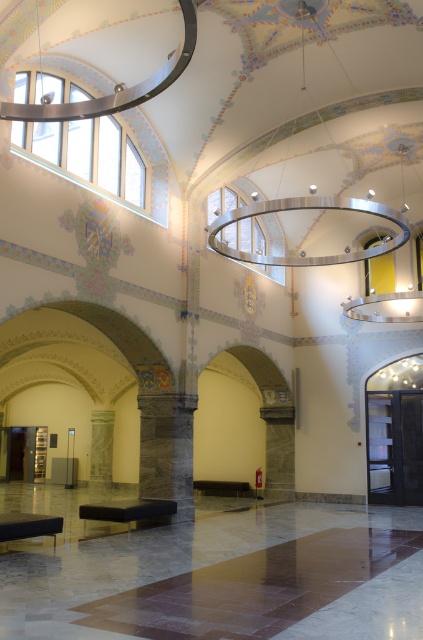
Looking at this image, you are standing in the grand building and want to exit through the matte black door at right. Which direction should you move relative to the marble pillar at center?

The matte black door at right is to the right of the marble pillar at center, so you should move to the right side of the marble pillar at center to reach the matte black door at right.

You are an interior designer planning to place a 1.2 meter wide sofa in this grand building. The sofa must be placed near either the matte black door at right or the marble pillar at center. Based on their widths, which object should you choose to ensure the sofa fits comfortably without blocking the doorway?

The matte black door at right is wider than the marble pillar at center. Since the sofa is 1.2 meters wide, placing it near the wider matte black door at right would provide more space and prevent blocking the doorway.